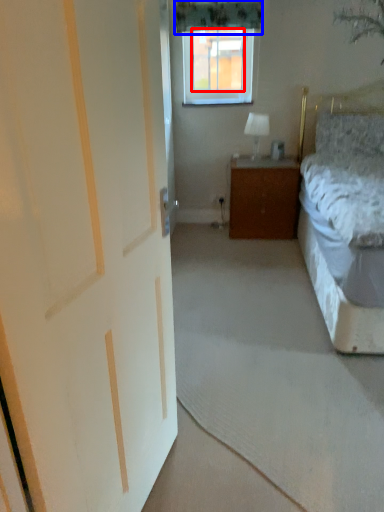
Question: Which object is closer to the camera taking this photo, window screen (highlighted by a red box) or curtain (highlighted by a blue box)?

Choices:
 (A) window screen
 (B) curtain

Answer: (B)